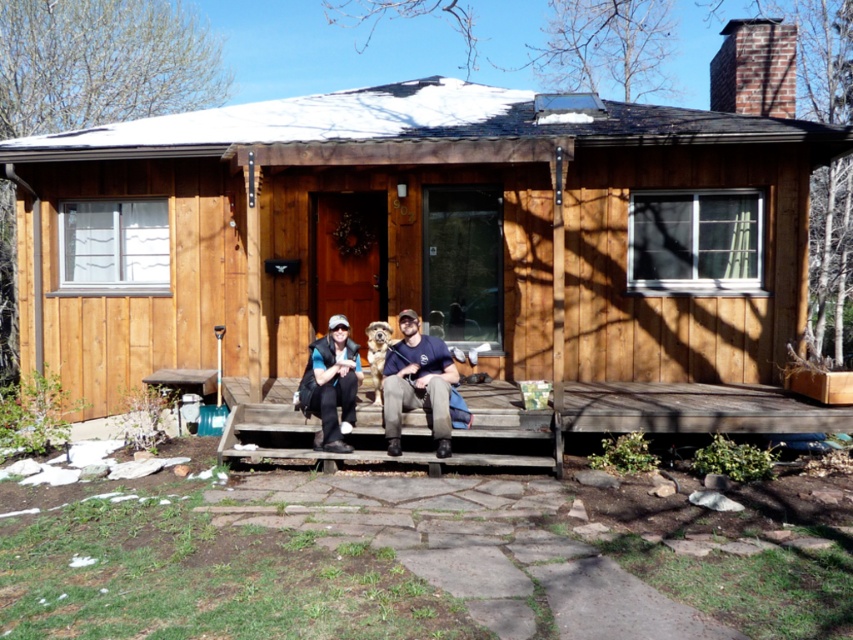
You are planning to sit on the wooden bench at center with your friend. There is a blue denim jacket at center already placed on the bench. Do you think there is enough space for both of you to sit comfortably?

The wooden bench at center is wider than the blue denim jacket at center, so there should be enough space for both you and your friend to sit comfortably on the wooden bench at center.

You are standing at the point with coordinates point (430, 228). Which object are you facing?

The point (430, 228) corresponds to the wooden cabin at center, so you are facing the wooden cabin at center.